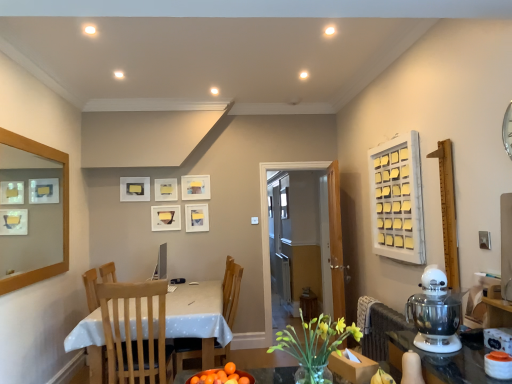
Question: Should I look upward or downward to see white wooden frame at upper right, positioned as the 2th window in left-to-right order?

Choices:
 (A) up
 (B) down

Answer: (B)

Question: Can you confirm if transparent glass door at center is thinner than transparent glass window at center, which ranks as the 1th window in left-to-right order?

Choices:
 (A) no
 (B) yes

Answer: (A)

Question: Can you confirm if transparent glass door at center is bigger than transparent glass window at center, which ranks as the 1th window in left-to-right order?

Choices:
 (A) no
 (B) yes

Answer: (B)

Question: Considering the relative sizes of transparent glass door at center and transparent glass window at center, which appears as the second window when viewed from the right, in the image provided, is transparent glass door at center shorter than transparent glass window at center, which appears as the second window when viewed from the right,?

Choices:
 (A) yes
 (B) no

Answer: (B)

Question: From the image's perspective, would you say transparent glass door at center is positioned over transparent glass window at center, which ranks as the 1th window in left-to-right order?

Choices:
 (A) yes
 (B) no

Answer: (B)

Question: Considering the relative sizes of transparent glass door at center and transparent glass window at center, the first window when ordered from back to front, in the image provided, is transparent glass door at center smaller than transparent glass window at center, the first window when ordered from back to front,?

Choices:
 (A) no
 (B) yes

Answer: (A)

Question: Considering the relative sizes of transparent glass door at center and transparent glass window at center, which appears as the second window when viewed from the right, in the image provided, is transparent glass door at center wider than transparent glass window at center, which appears as the second window when viewed from the right,?

Choices:
 (A) no
 (B) yes

Answer: (B)

Question: Considering the relative sizes of wooden chair at center, which is counted as the second chair, starting from the front, and yellow glass vase at center in the image provided, is wooden chair at center, which is counted as the second chair, starting from the front, bigger than yellow glass vase at center?

Choices:
 (A) no
 (B) yes

Answer: (B)

Question: Is wooden chair at center, which is counted as the second chair, starting from the front, aimed at yellow glass vase at center?

Choices:
 (A) yes
 (B) no

Answer: (B)

Question: Does wooden chair at center, which is counted as the second chair, starting from the front, appear on the left side of yellow glass vase at center?

Choices:
 (A) no
 (B) yes

Answer: (B)

Question: Is wooden chair at center, the first chair positioned from the back, directly adjacent to yellow glass vase at center?

Choices:
 (A) yes
 (B) no

Answer: (B)

Question: Is wooden chair at center, which is counted as the second chair, starting from the front, looking in the opposite direction of yellow glass vase at center?

Choices:
 (A) no
 (B) yes

Answer: (A)

Question: Would you consider wooden chair at center, the first chair positioned from the back, to be distant from yellow glass vase at center?

Choices:
 (A) no
 (B) yes

Answer: (B)

Question: Does wooden chair at center, the first chair positioned from the back, have a smaller size compared to white dotted fabric at lower left?

Choices:
 (A) no
 (B) yes

Answer: (B)